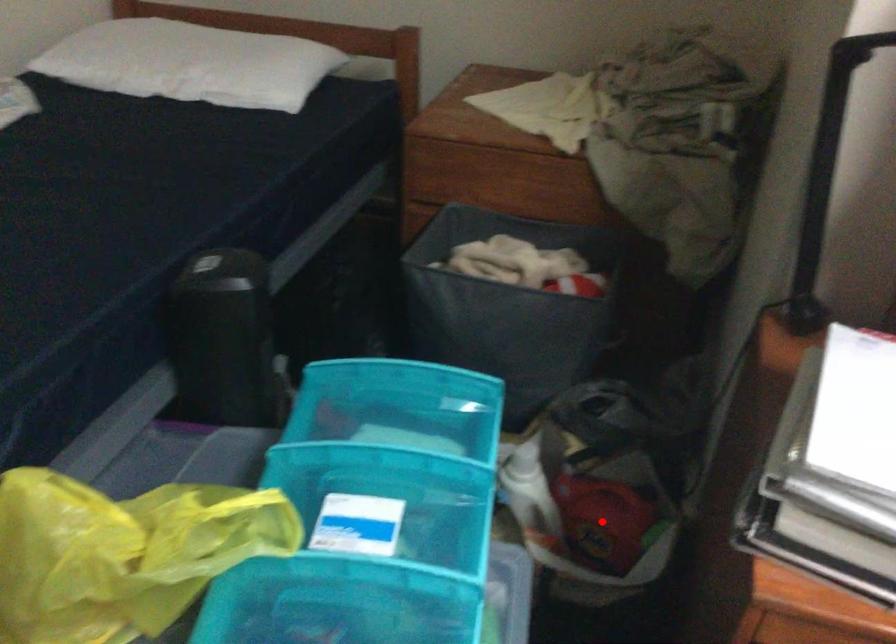
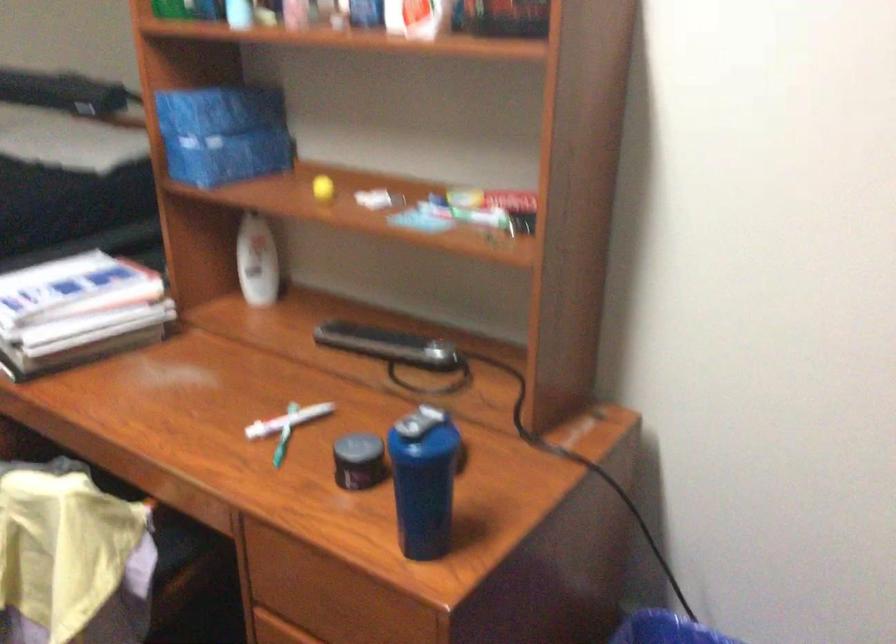
Question: I am providing you with two images of the same scene from different viewpoints. A red point is marked on the first image. Is the red point's position out of view in image 2?

Choices:
 (A) Yes
 (B) No

Answer: (A)